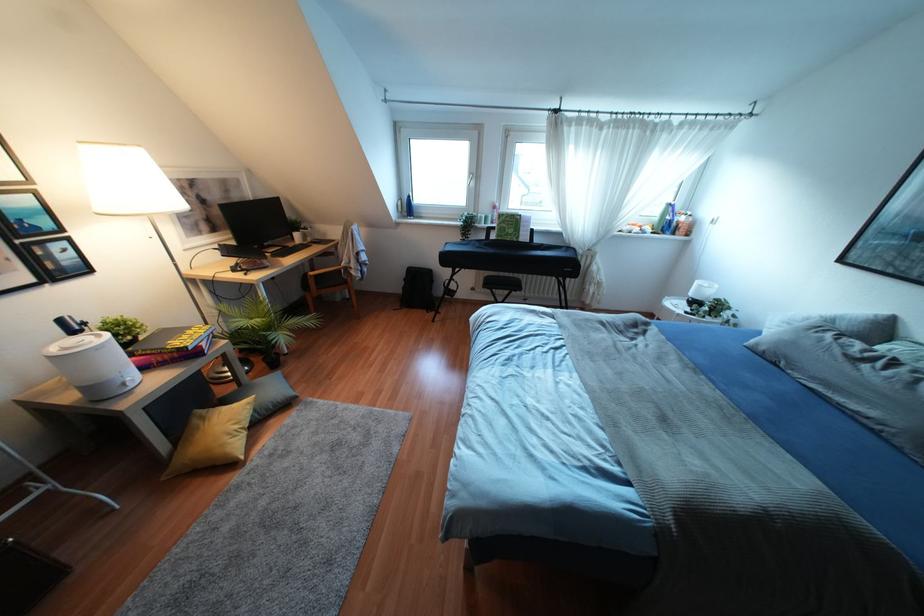
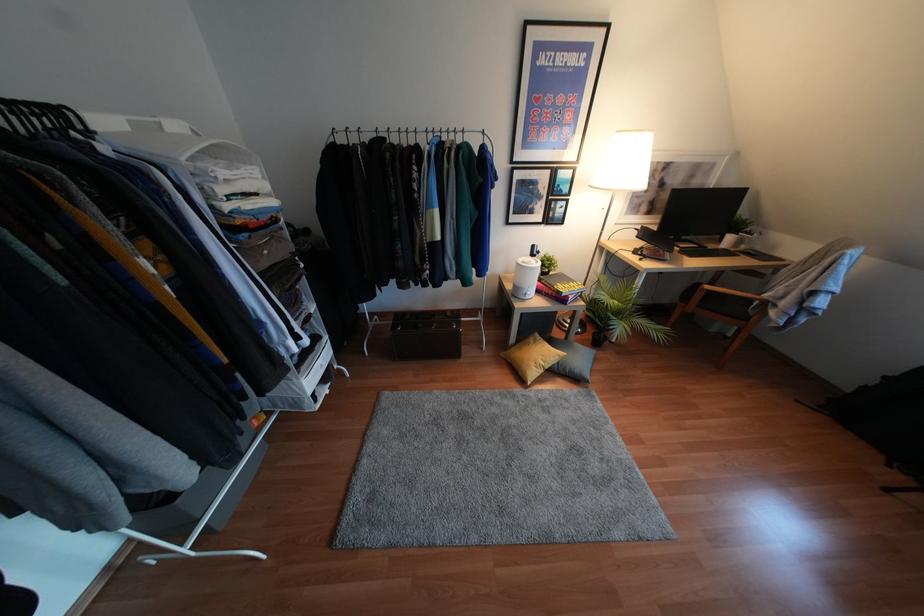
Where in the second image is the point corresponding to (x=276, y=353) from the first image?

(604, 336)